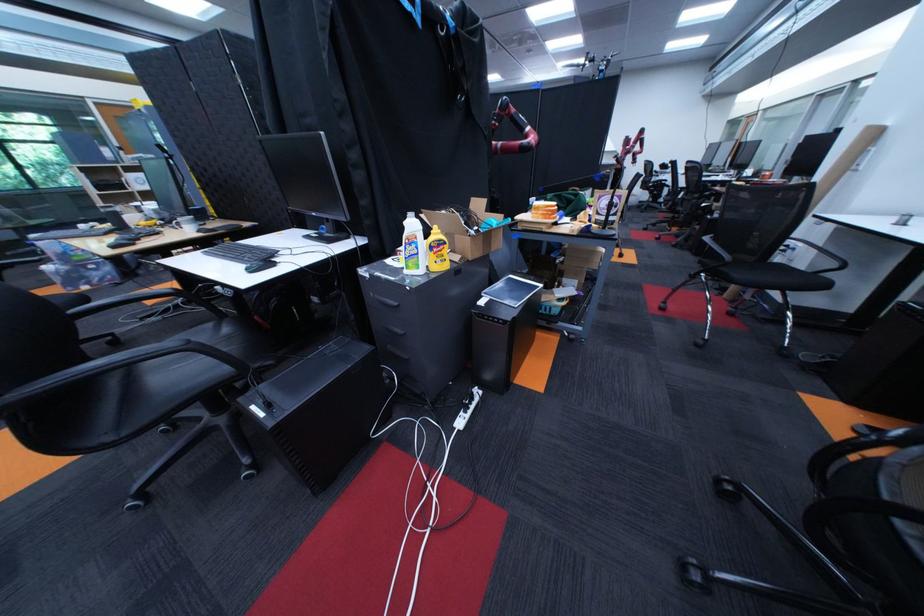
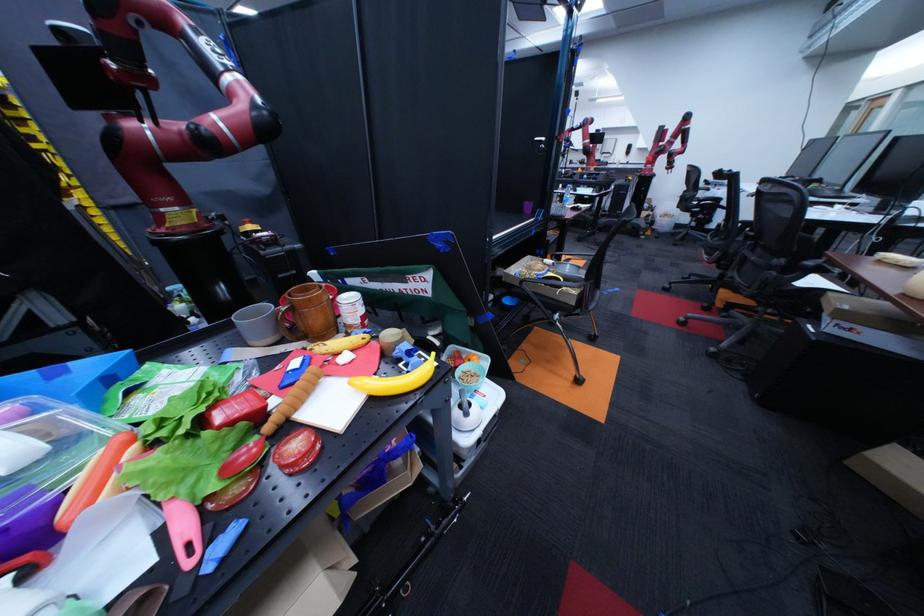
In the scene shown: What movement of the cameraman would produce the second image?

The cameraman moved toward right, forward.